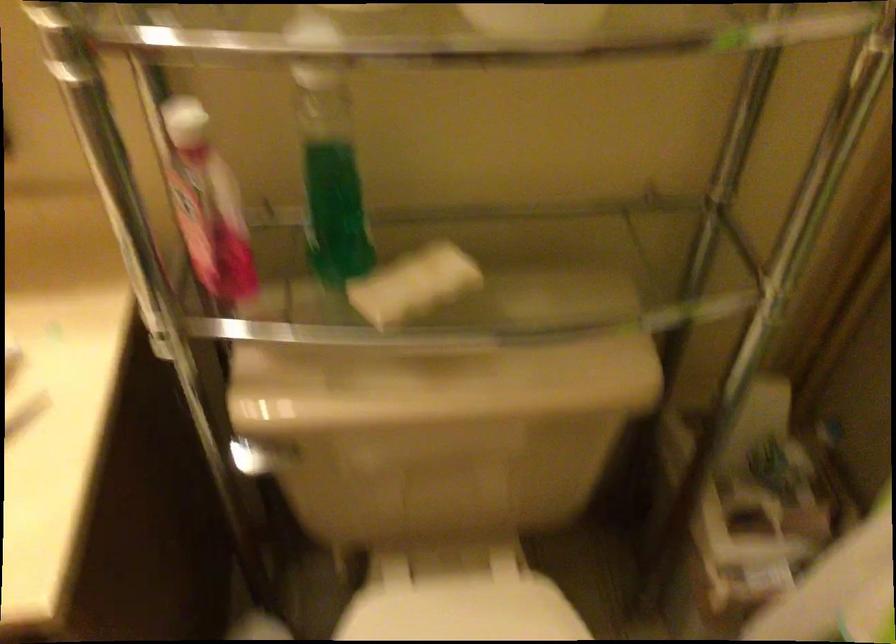
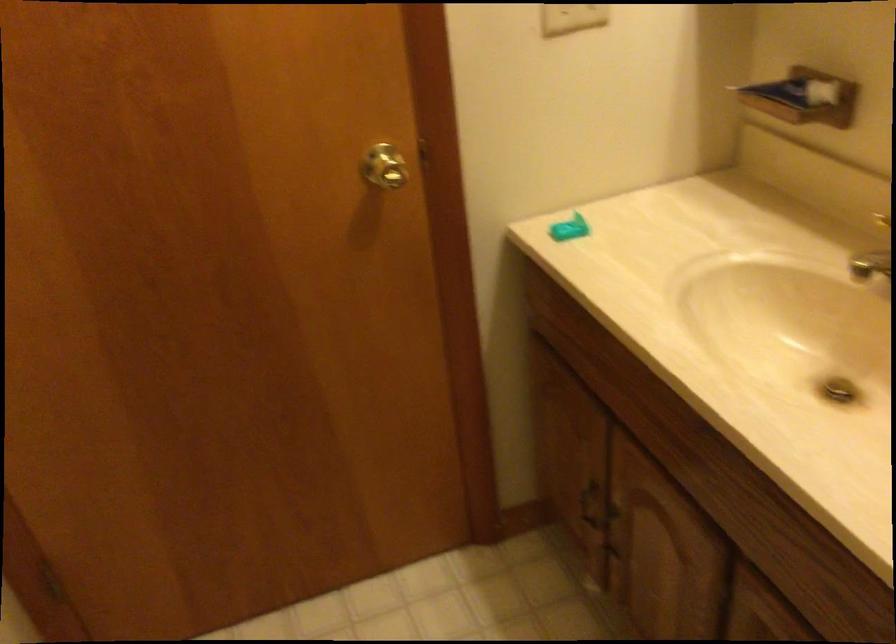
Question: Based on the continuous images, in which direction is the camera rotating? Reply with the corresponding letter.

Choices:
 (A) Left
 (B) Right
 (C) Up
 (D) Down

Answer: (A)